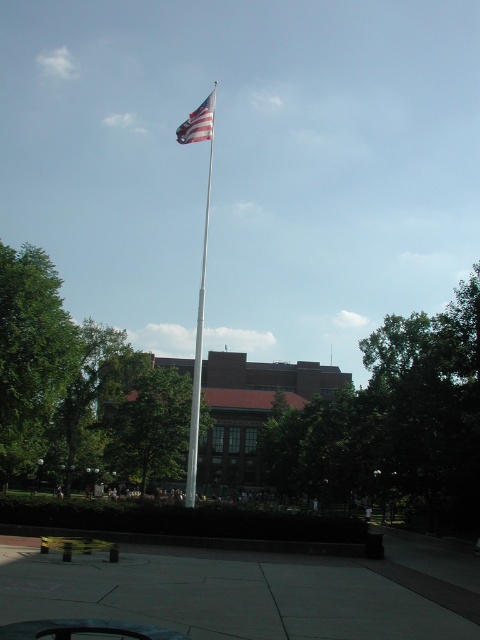
Is white metallic flag pole at center closer to the viewer compared to american flag at upper center?

Yes, white metallic flag pole at center is closer to the viewer.

Does white metallic flag pole at center appear under american flag at upper center?

Yes, white metallic flag pole at center is below american flag at upper center.

Is point (193, 369) farther from camera compared to point (200, 134)?

Yes, point (193, 369) is farther from viewer.

I want to click on white metallic flag pole at center, so click(x=201, y=278).